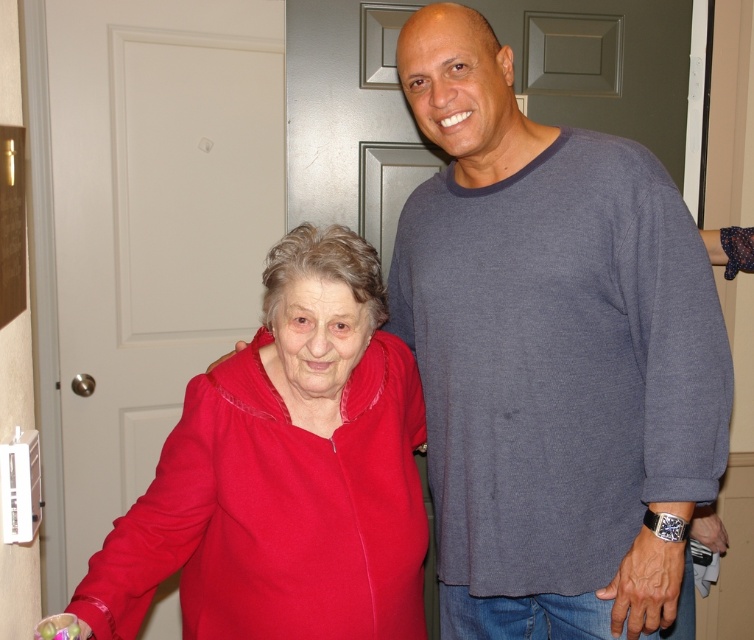
You are a photographer standing 1.5 meters away from the camera position. You want to take a photo of the gray cotton shirt at right. Can you reach it with your hand to adjust it before taking the photo?

The gray cotton shirt at right is 1.22 meters away from the camera. Since you are standing 1.5 meters away from the camera position, the total distance between you and the gray cotton shirt at right is 2.72 meters. This distance is too far to reach with your hand to adjust it before taking the photo.

You are a photographer setting up for a portrait session. You need to position a light source between the gray cotton shirt at right and the matte red sweater at left. Based on their positions, which object should the light be placed closer to in order to ensure proper illumination?

The gray cotton shirt at right is closer to the viewer than the matte red sweater at left. To ensure proper illumination, the light source should be placed closer to the matte red sweater at left so that both subjects receive adequate lighting.

You are standing in the room and want to move from the point marked as point [682,520] to the point marked as point [385,396]. Which direction should you move to get closer to your destination?

To move from point [682,520] to point [385,396], you should move diagonally towards the upper left direction since point [682,520] is in front of point [385,396].